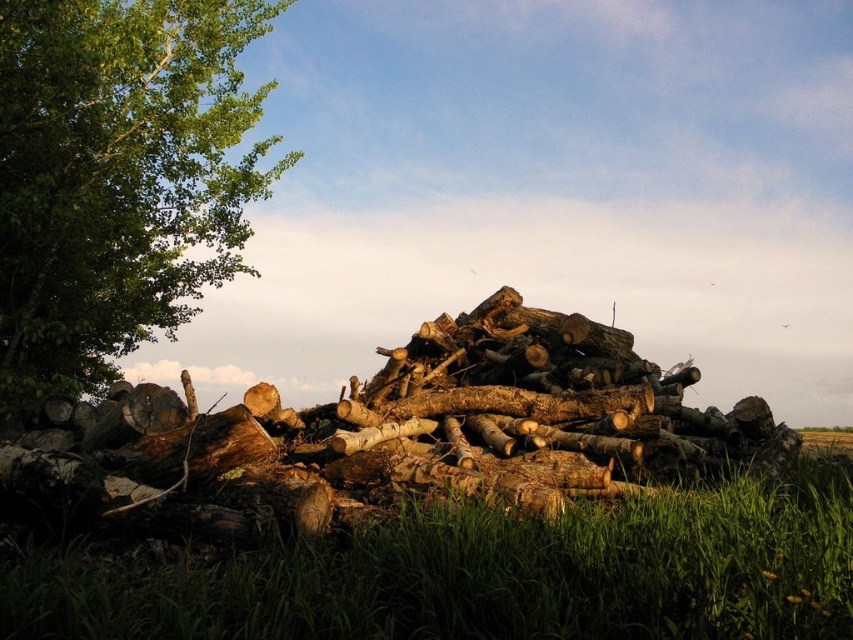
You are standing in the rural area looking at the scene. You need to walk from the green leafy tree at left to the green grass at lower center. Which direction should you move?

You should move to the right to reach the green grass at lower center from the green leafy tree at left since the green grass at lower center is positioned to the right of the green leafy tree at left.

You are a gardener who wants to plant a new flower bed. You notice the green grass at lower center and the green leafy tree at left. Which area would be better for planting if you want your flowers to grow taller than the tree?

The green grass at lower center has a lesser height compared to green leafy tree at left. Since the grass is shorter, planting flowers there might not allow them to grow taller than the tree. However, if you plant near the tree, the flowers could potentially grow taller than the tree itself, but this depends on the tree height. Wait, the question says the grass is shorter than the tree. To have flowers taller than the tree, you need to choose an area where the flowers can surpass the tree height. Since the